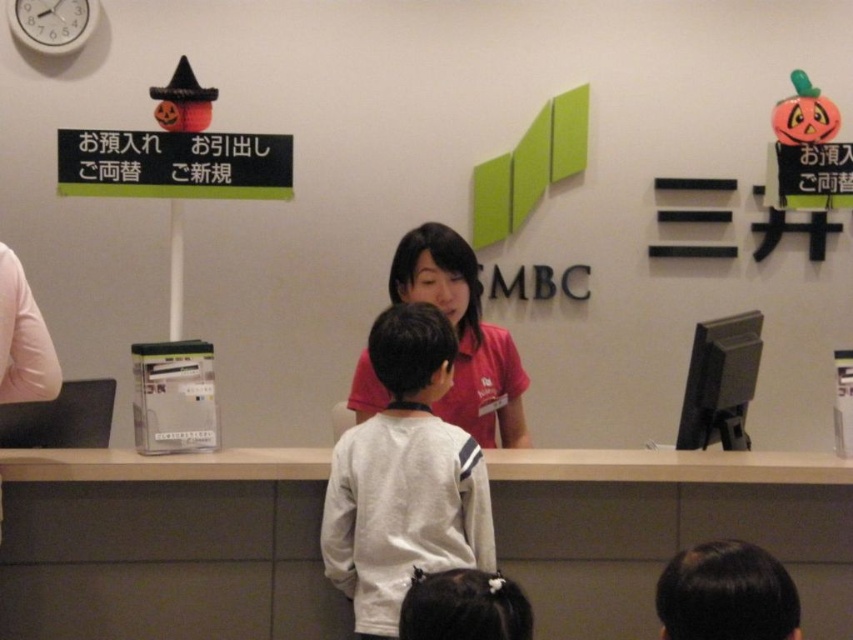
Question: Does white matte information desk at center appear on the left side of red matte shirt at center?

Choices:
 (A) yes
 (B) no

Answer: (B)

Question: Which of the following is the closest to the observer?

Choices:
 (A) white plastic clock at upper left
 (B) red matte shirt at center
 (C) white matte information desk at center
 (D) white fleece jacket at center

Answer: (D)

Question: Considering the relative positions of white matte information desk at center and white plastic clock at upper left in the image provided, where is white matte information desk at center located with respect to white plastic clock at upper left?

Choices:
 (A) below
 (B) above

Answer: (A)

Question: Estimate the real-world distances between objects in this image. Which object is farther from the red matte shirt at center?

Choices:
 (A) white matte information desk at center
 (B) white fleece jacket at center

Answer: (B)

Question: Can you confirm if white matte information desk at center is bigger than white plastic clock at upper left?

Choices:
 (A) yes
 (B) no

Answer: (A)

Question: Which object is the farthest from the white plastic clock at upper left?

Choices:
 (A) red matte shirt at center
 (B) white matte information desk at center
 (C) white fleece jacket at center

Answer: (B)